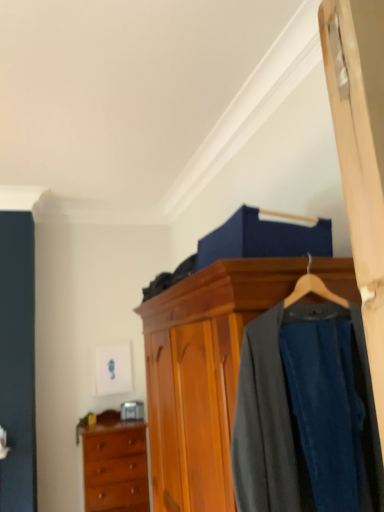
Question: Considering the positions of dark gray wool suit at center and wooden wardrobe at center in the image, is dark gray wool suit at center taller or shorter than wooden wardrobe at center?

Choices:
 (A) short
 (B) tall

Answer: (A)

Question: Considering the positions of dark gray wool suit at center and wooden wardrobe at center in the image, is dark gray wool suit at center bigger or smaller than wooden wardrobe at center?

Choices:
 (A) big
 (B) small

Answer: (B)

Question: Which of these objects is positioned closest to the dark gray wool suit at center?

Choices:
 (A) wooden wardrobe at center
 (B) wooden chest of drawers at lower left

Answer: (A)

Question: Considering the real-world distances, which object is closest to the wooden chest of drawers at lower left?

Choices:
 (A) wooden wardrobe at center
 (B) dark gray wool suit at center

Answer: (A)